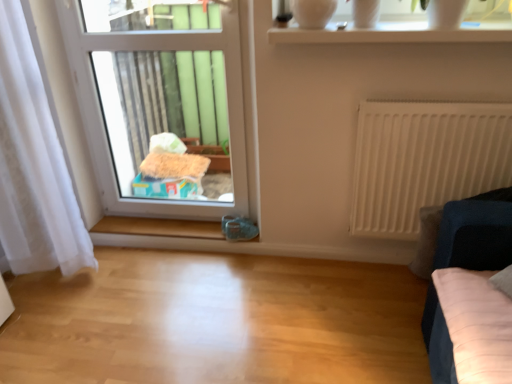
Question: Does white sheer curtain at left have a larger size compared to transparent plastic window at center, the 1th window from the back?

Choices:
 (A) no
 (B) yes

Answer: (B)

Question: From a real-world perspective, does white sheer curtain at left sit lower than transparent plastic window at center, the 1th window from the back?

Choices:
 (A) yes
 (B) no

Answer: (A)

Question: Considering the relative positions of white sheer curtain at left and transparent plastic window at center, the 2th window positioned from the front, in the image provided, is white sheer curtain at left behind transparent plastic window at center, the 2th window positioned from the front,?

Choices:
 (A) no
 (B) yes

Answer: (A)

Question: Does white sheer curtain at left contain transparent plastic window at center, the 2th window positioned from the front?

Choices:
 (A) no
 (B) yes

Answer: (A)

Question: Can you confirm if white sheer curtain at left is positioned to the left of transparent plastic window at center, the 1th window from the back?

Choices:
 (A) yes
 (B) no

Answer: (A)

Question: Is white sheer curtain at left wider than transparent plastic window at center, the 2th window positioned from the front?

Choices:
 (A) yes
 (B) no

Answer: (A)

Question: From a real-world perspective, is transparent glass vase at upper center positioned under white sheer curtain at left based on gravity?

Choices:
 (A) no
 (B) yes

Answer: (A)

Question: Does transparent glass vase at upper center have a larger size compared to white sheer curtain at left?

Choices:
 (A) no
 (B) yes

Answer: (A)

Question: Is transparent glass vase at upper center behind white sheer curtain at left?

Choices:
 (A) no
 (B) yes

Answer: (B)

Question: Is transparent glass vase at upper center positioned far away from white sheer curtain at left?

Choices:
 (A) yes
 (B) no

Answer: (A)

Question: From a real-world perspective, is transparent glass vase at upper center located higher than white sheer curtain at left?

Choices:
 (A) yes
 (B) no

Answer: (A)

Question: Is transparent glass vase at upper center positioned beyond the bounds of white sheer curtain at left?

Choices:
 (A) no
 (B) yes

Answer: (B)

Question: Does white matte radiator at right appear on the right side of velvet dark blue sofa at right?

Choices:
 (A) no
 (B) yes

Answer: (A)